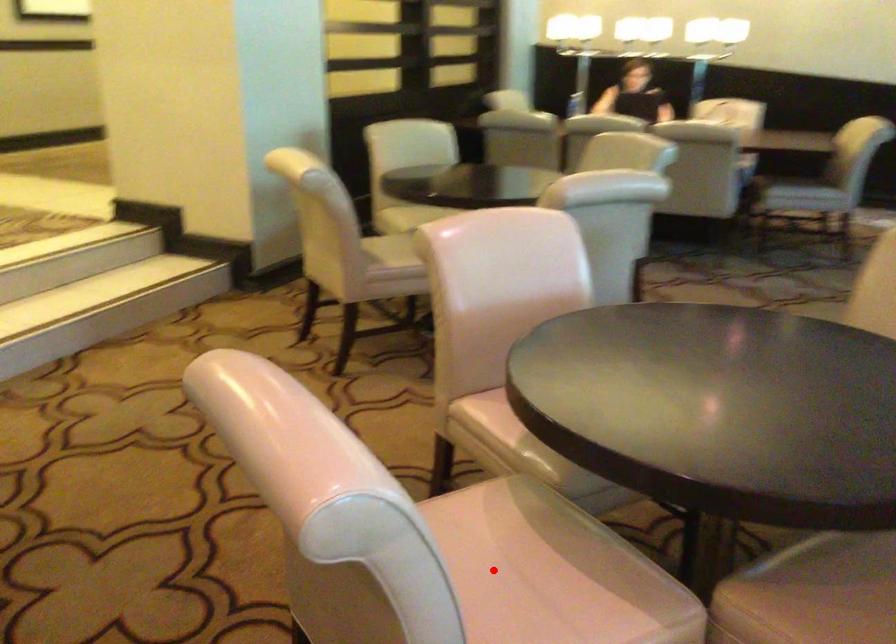
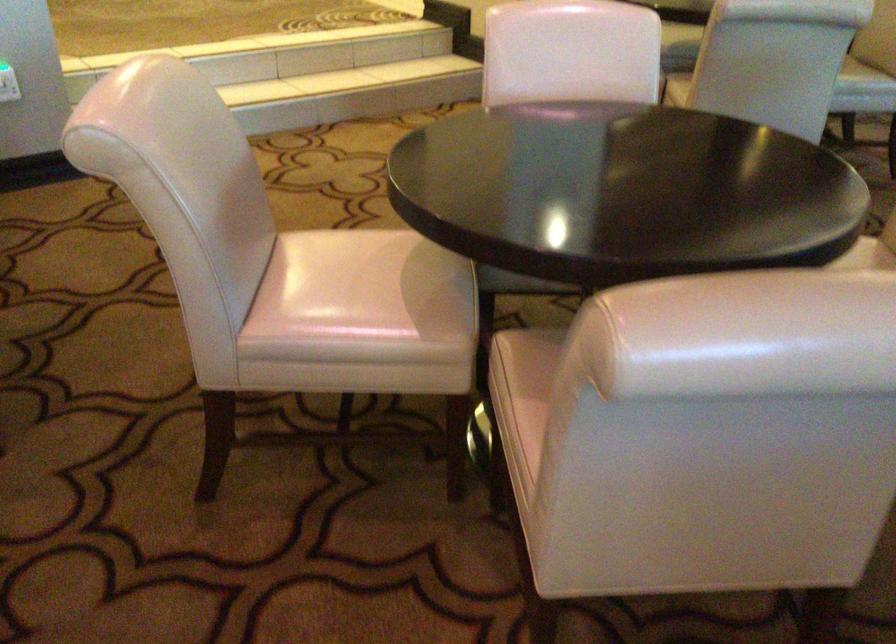
Question: I am providing you with two images of the same scene from different viewpoints. In image1, a red point is highlighted. Considering the same 3D point in image2, which of the following is correct?

Choices:
 (A) It is closer
 (B) It is farther

Answer: (B)